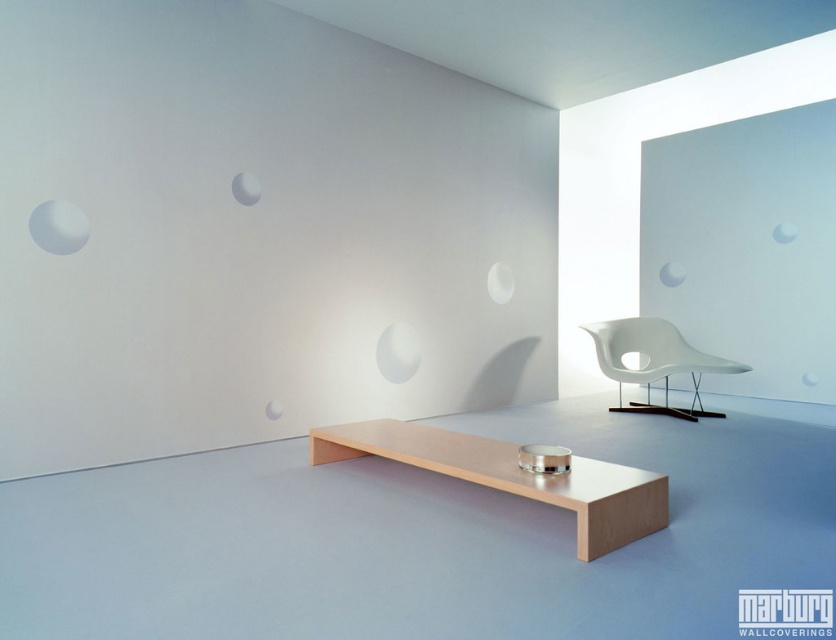
Question: Is natural wood stool at center closer to the viewer compared to white matte armchair at center-right?

Choices:
 (A) no
 (B) yes

Answer: (B)

Question: Is natural wood stool at center above white matte armchair at center-right?

Choices:
 (A) no
 (B) yes

Answer: (A)

Question: Is natural wood stool at center positioned before white matte armchair at center-right?

Choices:
 (A) yes
 (B) no

Answer: (A)

Question: Which of the following is the farthest from the observer?

Choices:
 (A) white matte armchair at center-right
 (B) natural wood stool at center

Answer: (A)